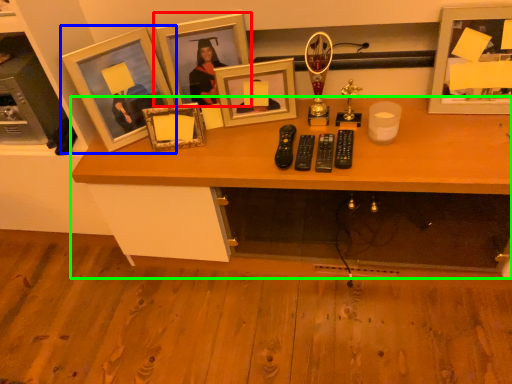
Question: Based on their relative distances, which object is nearer to picture frame (highlighted by a red box)? Choose from picture frame (highlighted by a blue box) and desk (highlighted by a green box).

Choices:
 (A) picture frame
 (B) desk

Answer: (A)